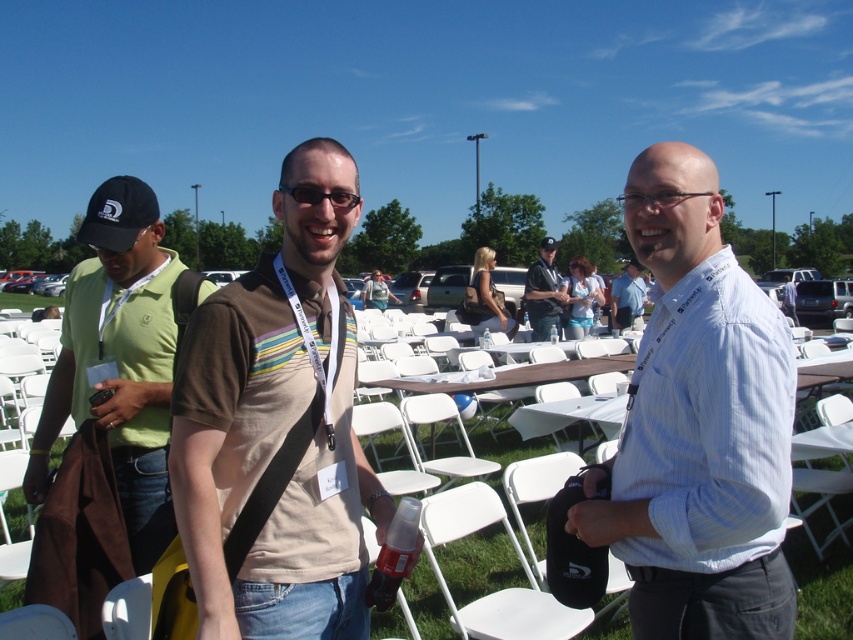
Question: Which point is closer to the camera?

Choices:
 (A) (136, 209)
 (B) (288, 520)
 (C) (669, 164)
 (D) (531, 291)

Answer: (B)

Question: Is matte black shirt at center in front of white shirt at center?

Choices:
 (A) yes
 (B) no

Answer: (A)

Question: Which object appears farthest from the camera in this image?

Choices:
 (A) white striped shirt at center
 (B) black plastic glasses at center
 (C) black fabric baseball cap at left
 (D) white plastic chair at lower center

Answer: (D)

Question: Does black fabric baseball cap at left have a smaller size compared to black plastic glasses at center?

Choices:
 (A) no
 (B) yes

Answer: (A)

Question: Is the position of white striped shirt at center more distant than that of white shirt at center?

Choices:
 (A) yes
 (B) no

Answer: (B)

Question: Which object is positioned farthest from the matte black shirt at center?

Choices:
 (A) white plastic chair at lower center
 (B) green fabric polo shirt at left
 (C) brown cotton t-shirt at center

Answer: (C)